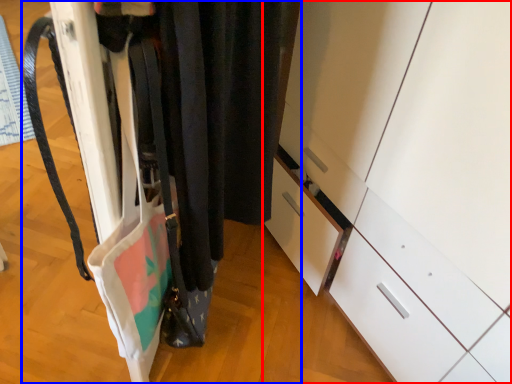
Question: Which object appears closest to the camera in this image, cabinetry (highlighted by a red box) or closet (highlighted by a blue box)?

Choices:
 (A) cabinetry
 (B) closet

Answer: (B)